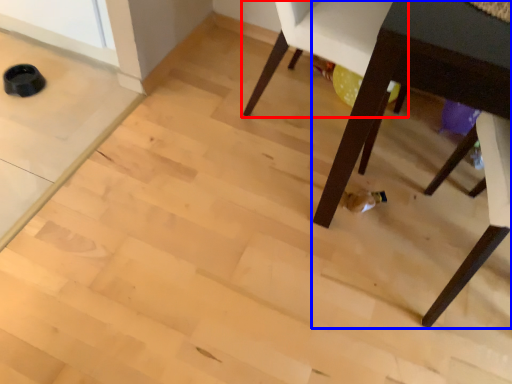
Question: Among these objects, which one is nearest to the camera, chair (highlighted by a red box) or table (highlighted by a blue box)?

Choices:
 (A) chair
 (B) table

Answer: (B)